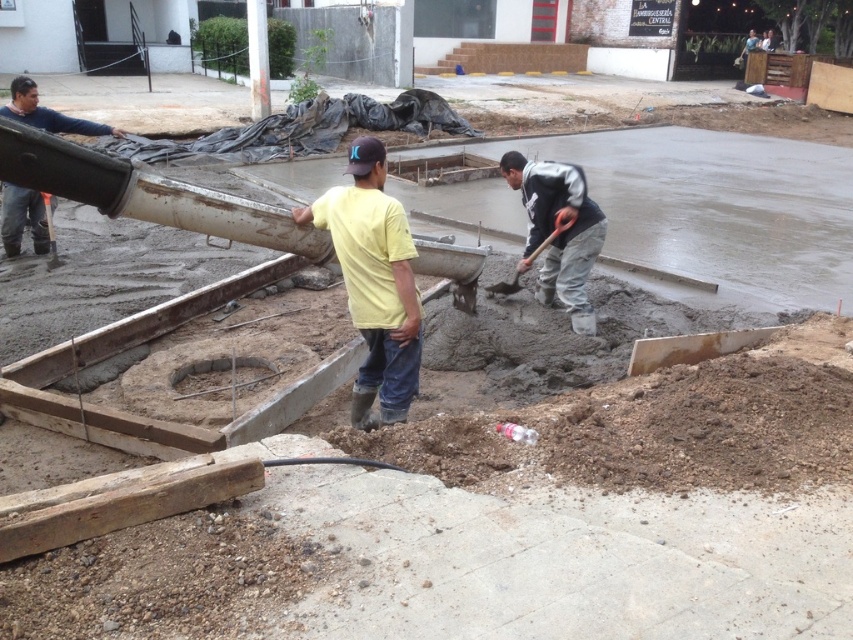
Question: Which of the following is the closest to the observer?

Choices:
 (A) yellow matte shirt at center
 (B) matte black pipe at left
 (C) gray concrete shovel at center

Answer: (A)

Question: Does yellow matte shirt at center have a lesser width compared to matte black pipe at left?

Choices:
 (A) no
 (B) yes

Answer: (B)

Question: Is gray concrete shovel at center behind matte black pipe at left?

Choices:
 (A) yes
 (B) no

Answer: (A)

Question: Which object is closer to the camera taking this photo?

Choices:
 (A) metallic gray shovel at center
 (B) yellow matte shirt at center
 (C) matte black pipe at left
 (D) gray concrete shovel at center

Answer: (B)

Question: Among these objects, which one is nearest to the camera?

Choices:
 (A) gray concrete shovel at center
 (B) matte black pipe at left

Answer: (B)

Question: Is matte black pipe at left to the right of metallic gray shovel at center from the viewer's perspective?

Choices:
 (A) yes
 (B) no

Answer: (B)